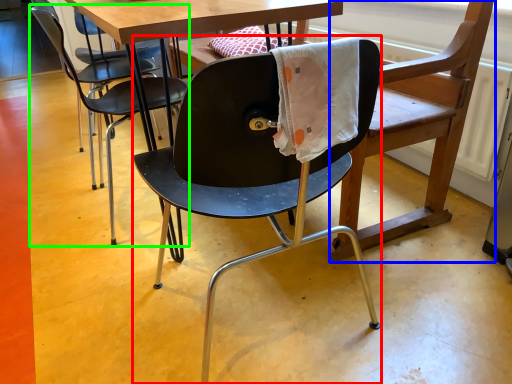
Question: Which object is the closest to the chair (highlighted by a red box)? Choose among these: swivel chair (highlighted by a blue box) or chair (highlighted by a green box).

Choices:
 (A) swivel chair
 (B) chair

Answer: (A)